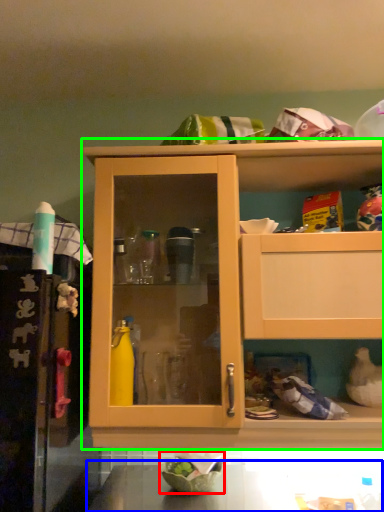
Question: Based on their relative distances, which object is farther from bowl (highlighted by a red box)? Choose from counter top (highlighted by a blue box) and cabinetry (highlighted by a green box).

Choices:
 (A) counter top
 (B) cabinetry

Answer: (B)